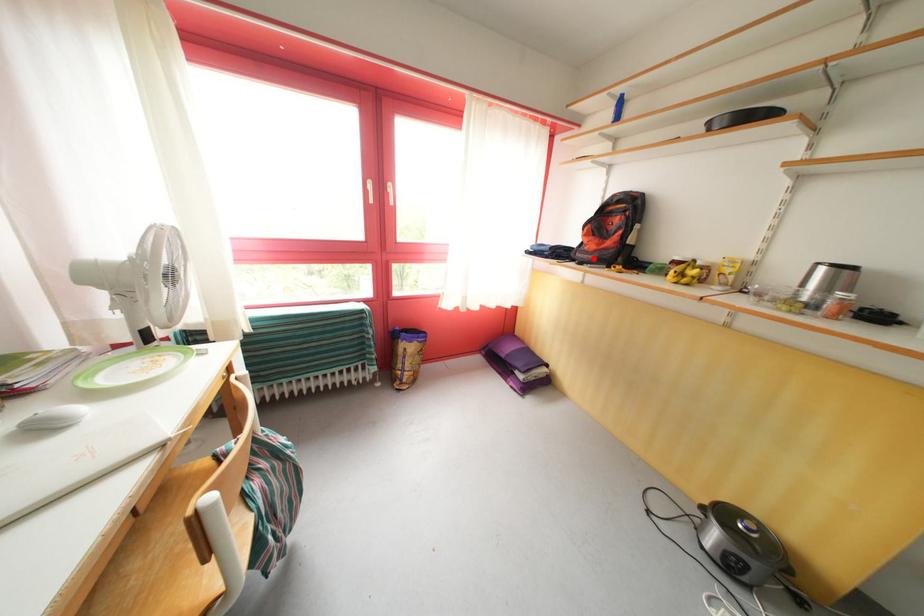
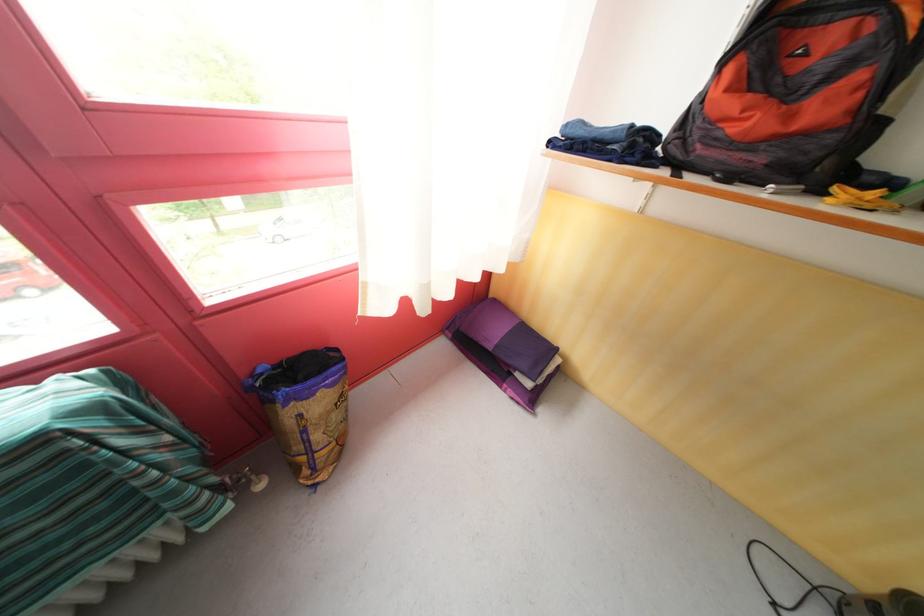
In the second image, find the point that corresponds to the highlighted location in the first image.

(736, 151)